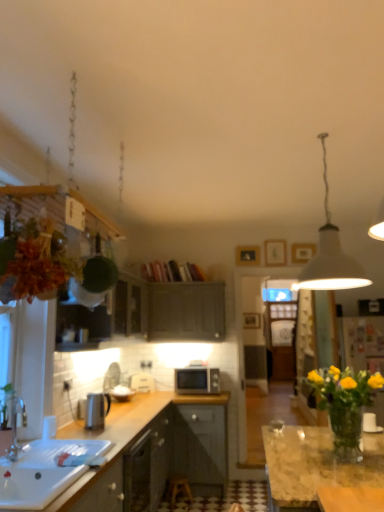
Locate an element on the screen. This screenshot has height=512, width=384. free spot in front of wooden stool at center is located at coordinates (188, 506).